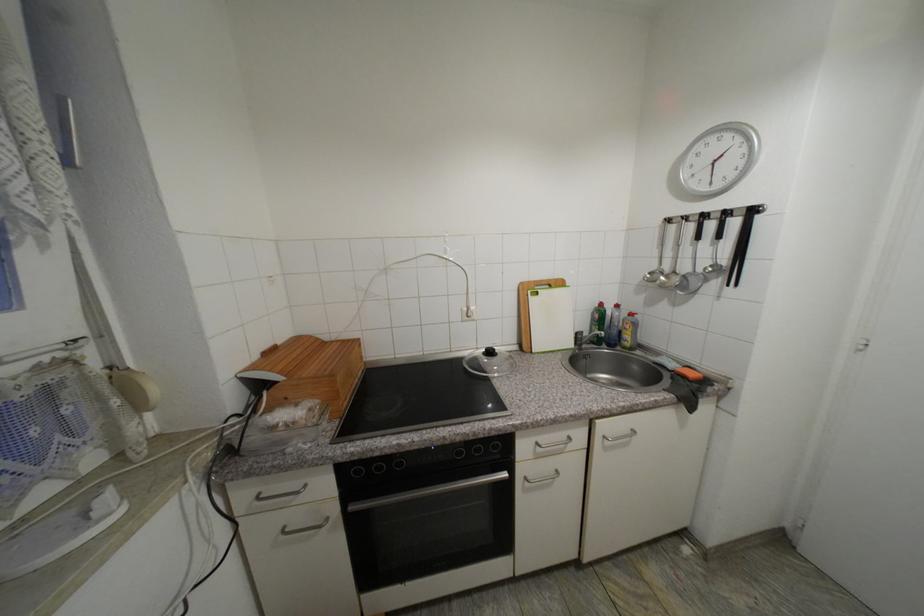
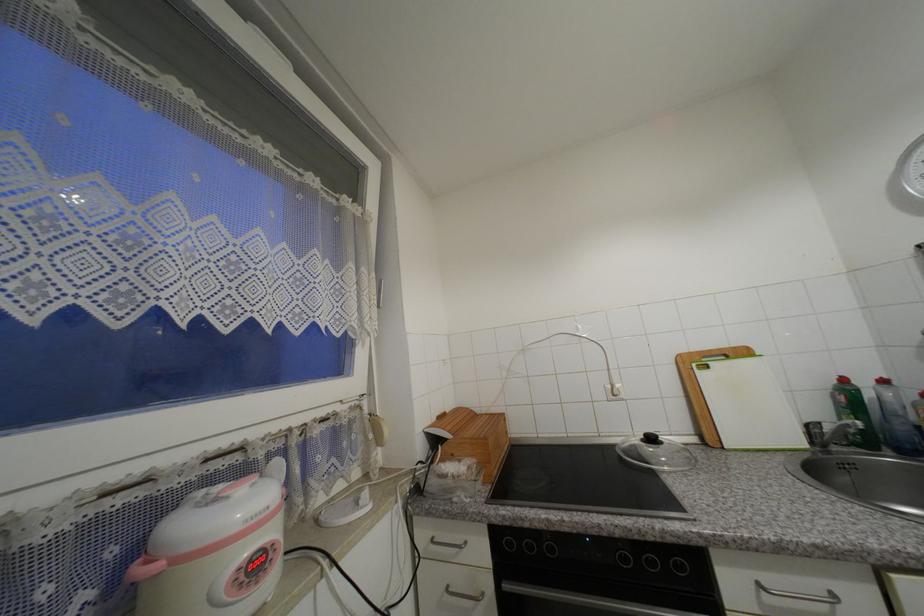
Find the pixel in the second image that matches (x=606, y=306) in the first image.

(849, 381)